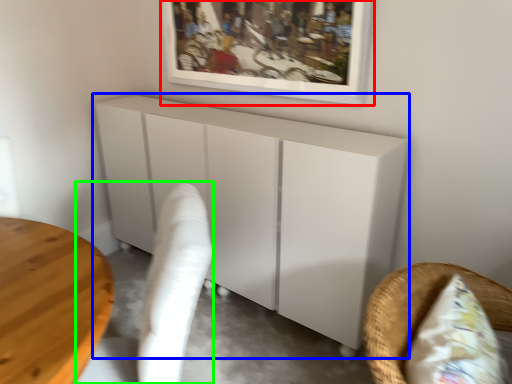
Question: Based on their relative distances, which object is nearer to picture frame (highlighted by a red box)? Choose from furniture (highlighted by a blue box) and swivel chair (highlighted by a green box).

Choices:
 (A) furniture
 (B) swivel chair

Answer: (A)